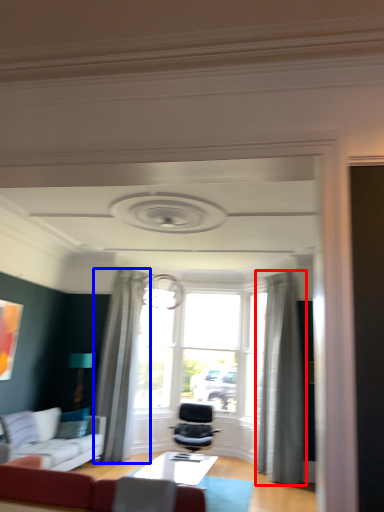
Question: Which point is closer to the camera, curtain (highlighted by a red box) or curtain (highlighted by a blue box)?

Choices:
 (A) curtain
 (B) curtain

Answer: (A)